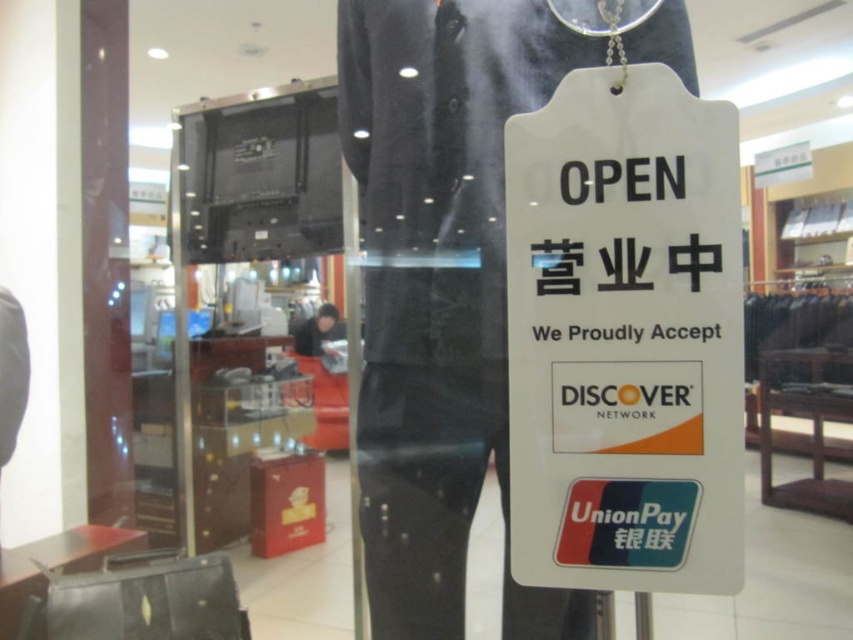
Question: Among these points, which one is nearest to the camera?

Choices:
 (A) (663, 577)
 (B) (480, 468)

Answer: (A)

Question: Which of the following is the farthest from the observer?

Choices:
 (A) (654, 124)
 (B) (403, 262)

Answer: (B)

Question: Is white paper sign at center below black fabric mannequin at center?

Choices:
 (A) yes
 (B) no

Answer: (B)

Question: Does white paper sign at center appear under black fabric mannequin at center?

Choices:
 (A) no
 (B) yes

Answer: (A)

Question: From the image, what is the correct spatial relationship of white paper sign at center in relation to black fabric mannequin at center?

Choices:
 (A) below
 (B) above

Answer: (B)

Question: Which object appears farthest from the camera in this image?

Choices:
 (A) white paper sign at center
 (B) black fabric mannequin at center

Answer: (B)